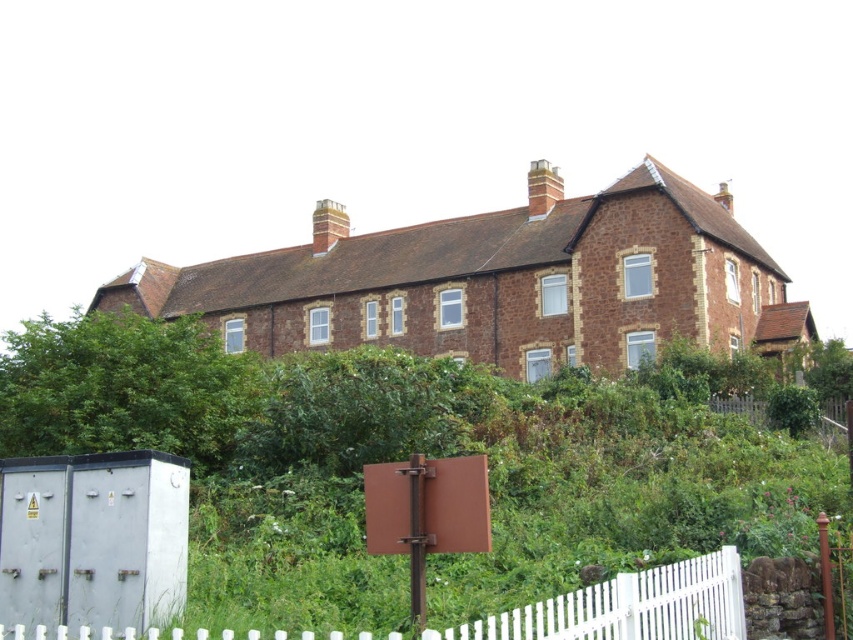
You are standing at the point marked as point [405,458] in the image. What is the immediate surface you are standing on?

The point [405,458] is on green leafy vegetation at center, so the immediate surface you are standing on is green leafy vegetation.

You are standing in front of the building and want to determine which of the two points, point (x=450, y=576) or point (x=718, y=620), is closer to you. Based on the scene, which point is nearer?

Point (x=450, y=576) is closer to you because it is further to the viewer than point (x=718, y=620).

You are a gardener who wants to trim the green leafy vegetation at center so that the white picket fence at lower right becomes fully visible. Based on their heights, is this possible?

The green leafy vegetation at center is taller than the white picket fence at lower right. Trimming the vegetation would allow the fence to become fully visible since the vegetation currently blocks part of it due to its greater height.